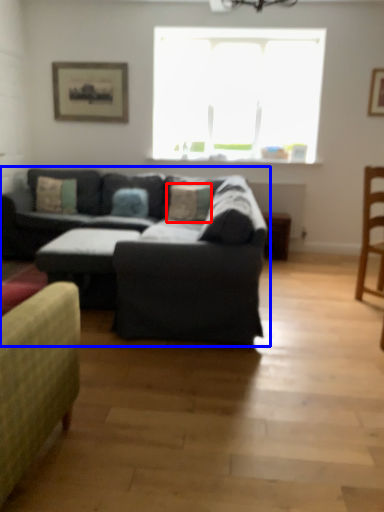
Question: Which point is closer to the camera, pillow (highlighted by a red box) or studio couch (highlighted by a blue box)?

Choices:
 (A) pillow
 (B) studio couch

Answer: (B)